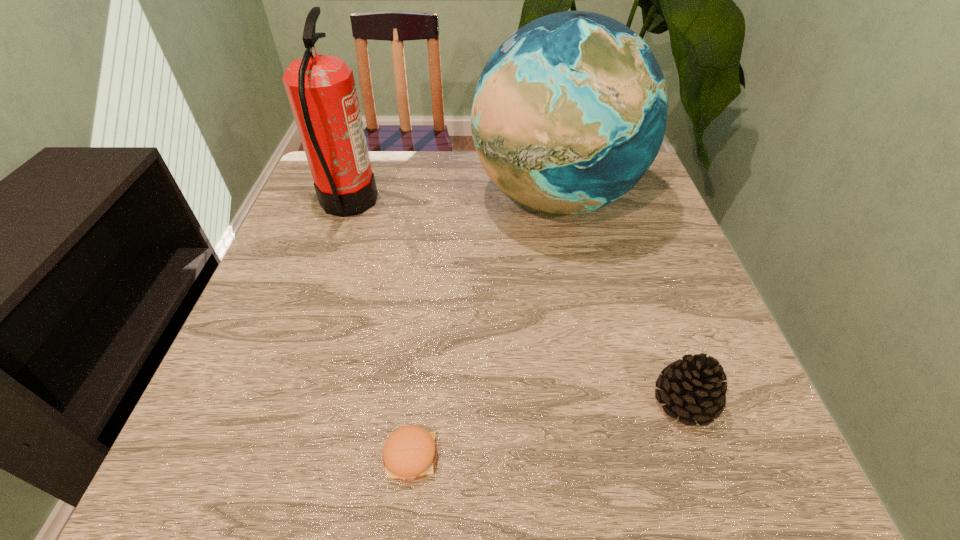
Locate an element on the screen. The image size is (960, 540). free point between the globe and the pinecone is located at coordinates (619, 299).

Locate an element on the screen. Image resolution: width=960 pixels, height=540 pixels. blank region between the third object from right to left and the fire extinguisher is located at coordinates (379, 330).

Identify the location of unoccupied area between the leftmost object and the shortest object. This screenshot has width=960, height=540. (379, 330).

What are the coordinates of `object that can be found as the third closest to the third tallest object` in the screenshot? It's located at (321, 89).

Choose which object is the second nearest neighbor to the fire extinguisher. Please provide its 2D coordinates. Your answer should be formatted as a tuple, i.e. [(x, y)], where the tuple contains the x and y coordinates of a point satisfying the conditions above.

[(409, 453)]

At what (x,y) coordinates should I click in order to perform the action: click on free space that satisfies the following two spatial constraints: 1. at the narrow end of the pinecone; 2. on the front side of the second object from left to right. Please return your answer as a coordinate pair (x, y). Image resolution: width=960 pixels, height=540 pixels. Looking at the image, I should click on (705, 456).

At what (x,y) coordinates should I click in order to perform the action: click on vacant region that satisfies the following two spatial constraints: 1. on the front side of the second object from left to right; 2. on the right side of the fire extinguisher. Please return your answer as a coordinate pair (x, y). Looking at the image, I should click on (261, 456).

You are a GUI agent. You are given a task and a screenshot of the screen. Output one action in this format:
    pyautogui.click(x=<x>, y=<y>)
    Task: Click on the free space that satisfies the following two spatial constraints: 1. on the front side of the fire extinguisher; 2. on the back side of the shortest object
    This screenshot has width=960, height=540.
    Given the screenshot: What is the action you would take?
    pyautogui.click(x=261, y=456)

In order to click on vacant region that satisfies the following two spatial constraints: 1. on the back side of the patty; 2. on the right side of the globe in this screenshot , I will do `click(439, 198)`.

The width and height of the screenshot is (960, 540). What are the coordinates of `free space that satisfies the following two spatial constraints: 1. on the front side of the leftmost object; 2. on the right side of the patty` in the screenshot? It's located at (261, 456).